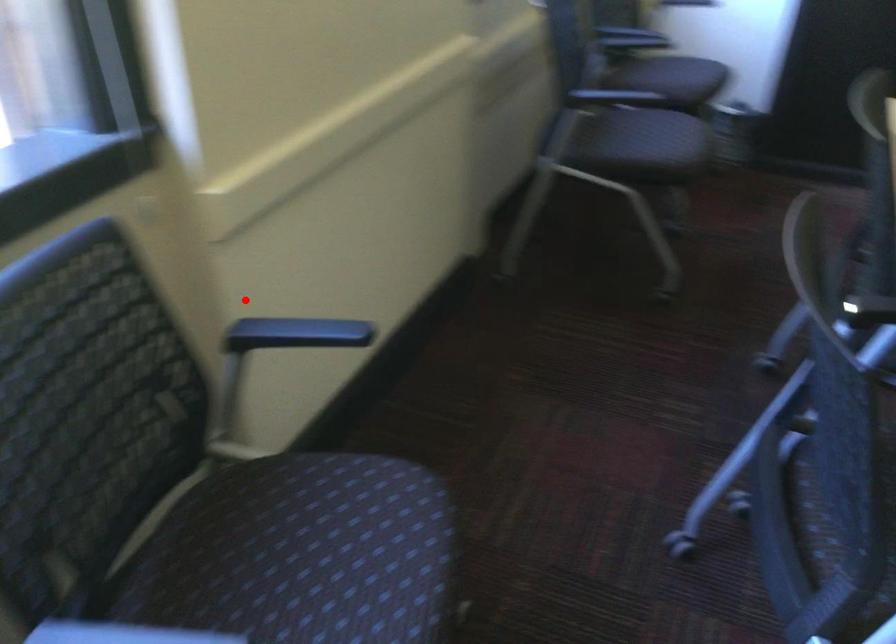
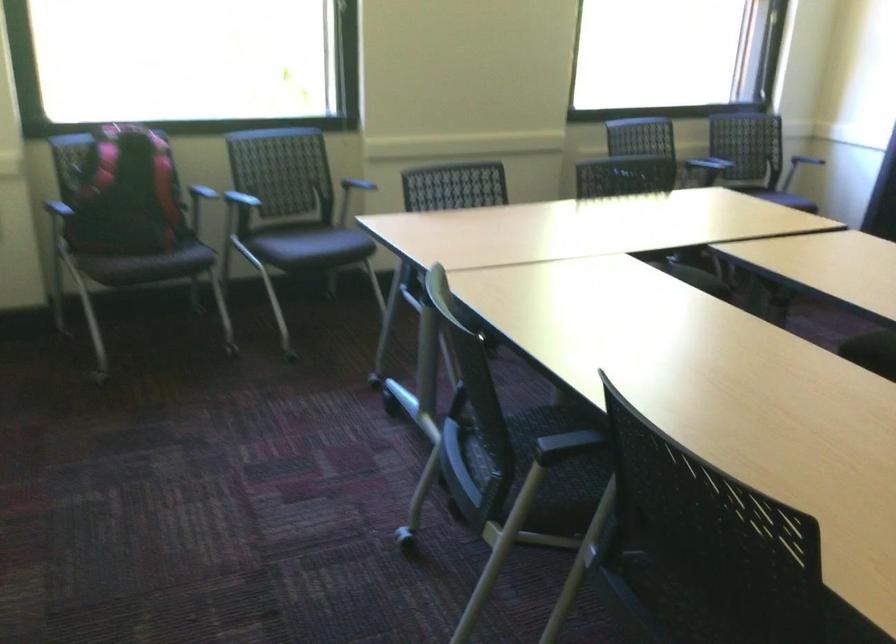
Question: I am providing you with two images of the same scene from different viewpoints. A red point is shown in image1. For the corresponding object point in image2, is it positioned nearer or farther from the camera?

Choices:
 (A) Nearer
 (B) Farther

Answer: (B)